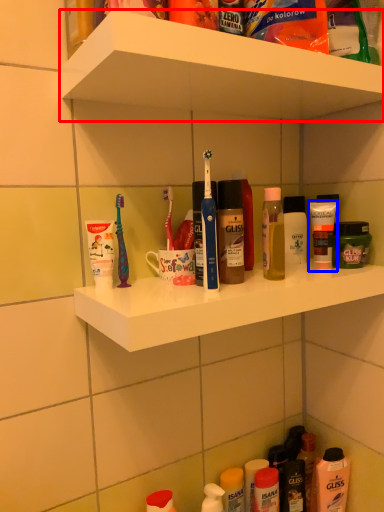
Question: Among these objects, which one is nearest to the camera, supermarket shelf (highlighted by a red box) or toiletry (highlighted by a blue box)?

Choices:
 (A) supermarket shelf
 (B) toiletry

Answer: (A)